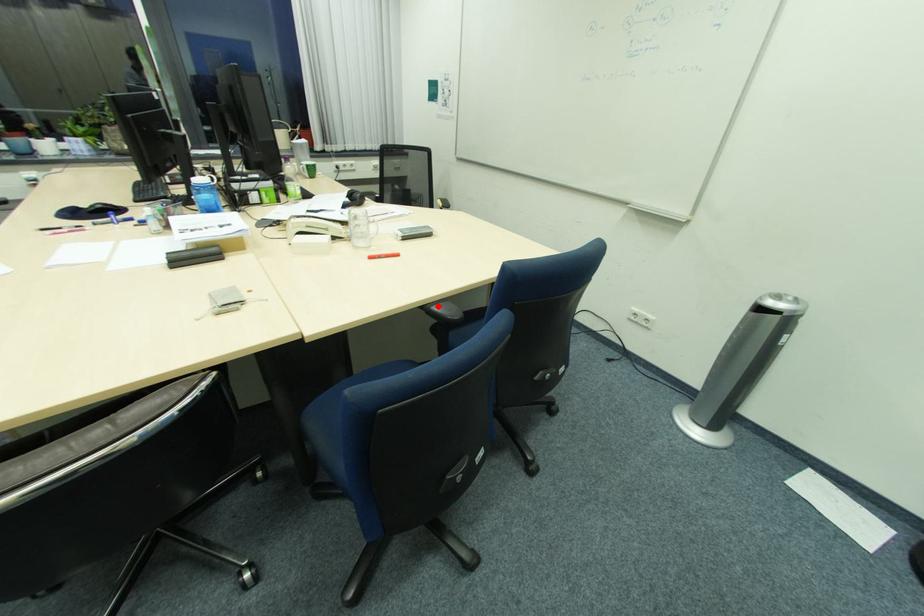
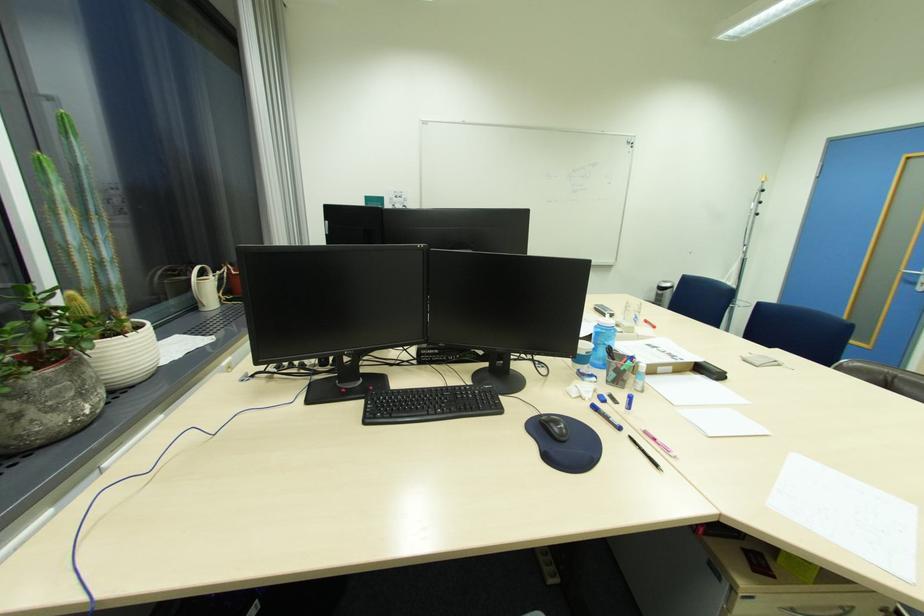
Question: I am providing you with two images of the same scene from different viewpoints. A red point is marked on the first image. Can you still see the location of the red point in image 2?

Choices:
 (A) Yes
 (B) No

Answer: (B)